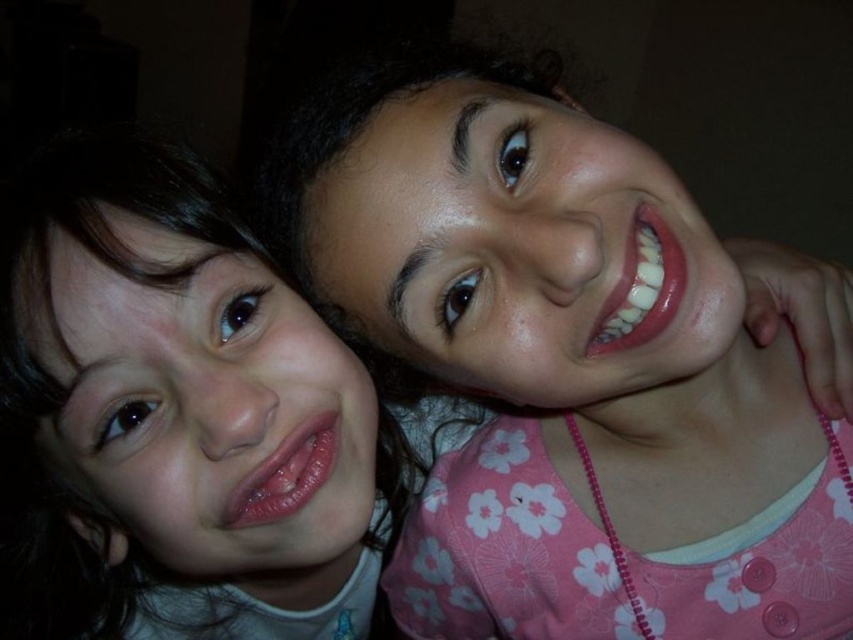
Question: Where is pink floral dress at upper right located in relation to smooth skin face at upper left in the image?

Choices:
 (A) below
 (B) above

Answer: (B)

Question: Is pink floral dress at upper right bigger than smooth skin face at upper left?

Choices:
 (A) yes
 (B) no

Answer: (B)

Question: Is the position of pink floral dress at upper right more distant than that of smooth skin face at upper left?

Choices:
 (A) no
 (B) yes

Answer: (A)

Question: Which point is closer to the camera?

Choices:
 (A) smooth skin face at upper left
 (B) pink floral dress at upper right

Answer: (B)